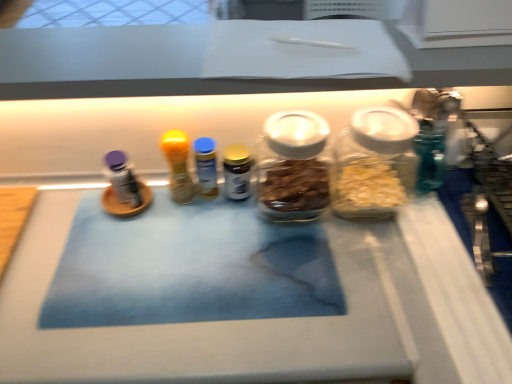
Locate an element on the screen. The width and height of the screenshot is (512, 384). vacant space that is to the left of gold metallic spice jar at center, which is counted as the third bottle, starting from the right is located at coordinates (137, 218).